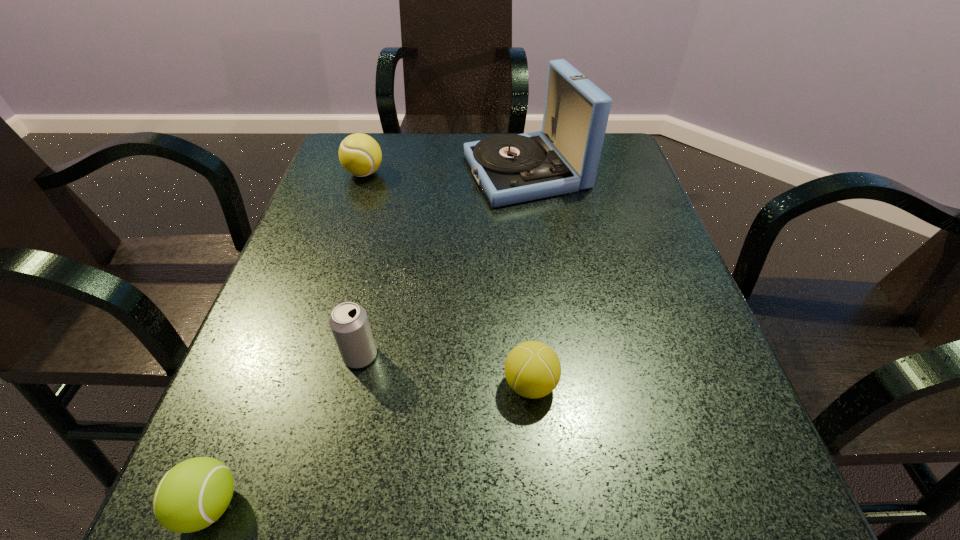
Find the location of `the tallest object`. the tallest object is located at coordinates (563, 158).

At what (x,y) coordinates should I click in order to perform the action: click on beer can. Please return your answer as a coordinate pair (x, y). Looking at the image, I should click on (349, 323).

I want to click on the tallest tennis ball, so click(x=360, y=155).

Find the location of a particular element. the rightmost tennis ball is located at coordinates (532, 369).

Where is `vacant region located on the back of the tallest object`? Image resolution: width=960 pixels, height=540 pixels. vacant region located on the back of the tallest object is located at coordinates (520, 133).

At what (x,y) coordinates should I click in order to perform the action: click on vacant position located 0.060m on the front of the beer can. Please return your answer as a coordinate pair (x, y). Image resolution: width=960 pixels, height=540 pixels. Looking at the image, I should click on (349, 405).

Where is `vacant space located on the back of the farthest tennis ball`? vacant space located on the back of the farthest tennis ball is located at coordinates (372, 148).

The height and width of the screenshot is (540, 960). Identify the location of blank space located 0.150m on the right of the rightmost tennis ball. (655, 384).

Identify the location of phonograph record positioned at the far edge. (563, 158).

Locate an element on the screen. The image size is (960, 540). tennis ball that is positioned at the far edge is located at coordinates (360, 155).